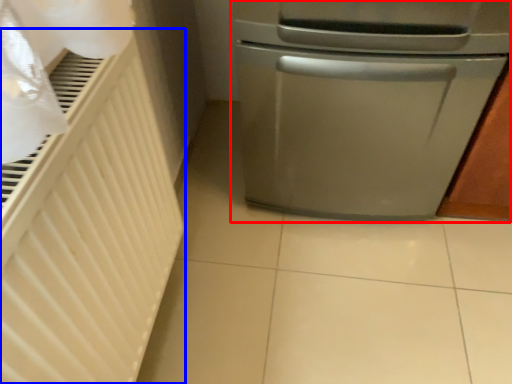
Question: Which object appears closest to the camera in this image, home appliance (highlighted by a red box) or radiator (highlighted by a blue box)?

Choices:
 (A) home appliance
 (B) radiator

Answer: (B)